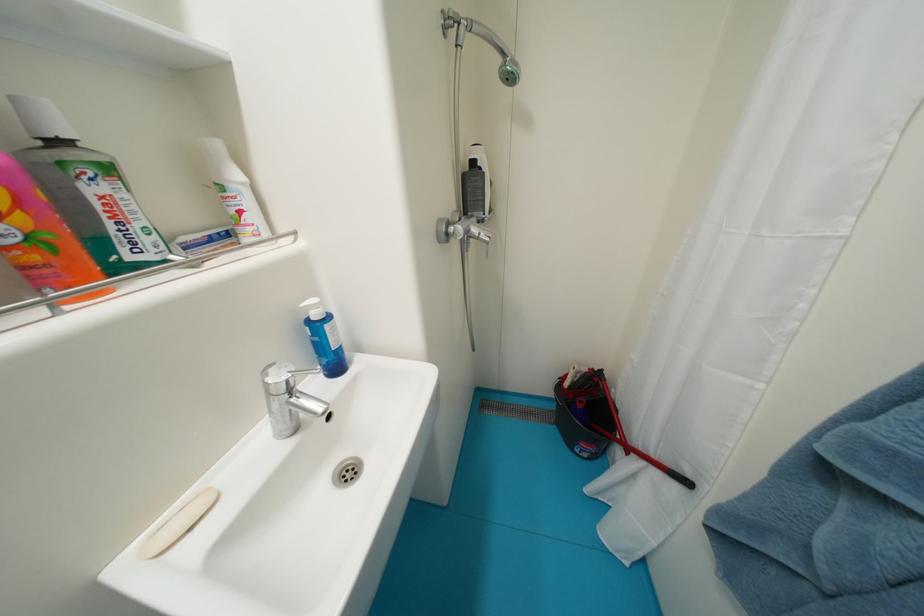
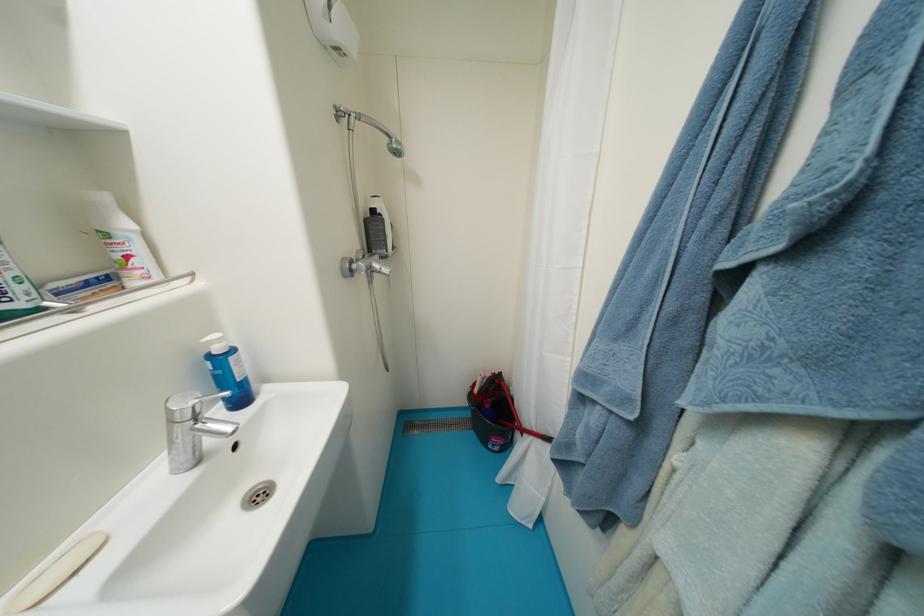
Where in the second image is the point corresponding to [323,308] from the first image?

(225, 342)